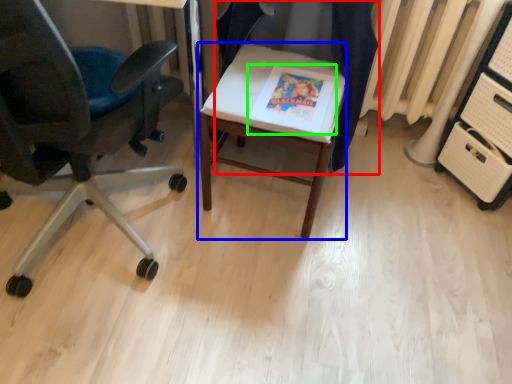
Question: Based on their relative distances, which object is farther from chair (highlighted by a red box)? Choose from desk (highlighted by a blue box) and magazine (highlighted by a green box).

Choices:
 (A) desk
 (B) magazine

Answer: (A)